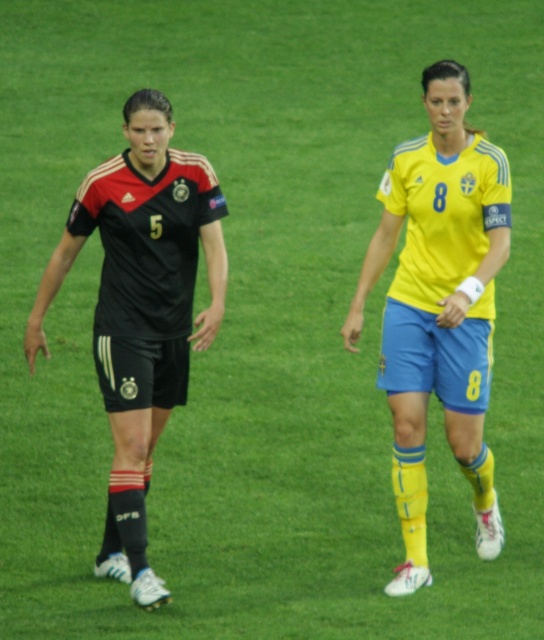
Between yellow matte jersey at center and matte black jersey at left, which one has less height?

With less height is matte black jersey at left.

Is point (429, 109) positioned after point (182, 253)?

No, it is in front of (182, 253).

This screenshot has height=640, width=544. Find the location of `yellow matte jersey at center`. yellow matte jersey at center is located at coordinates (438, 305).

Locate an element on the screen. yellow matte jersey at center is located at coordinates 438,305.